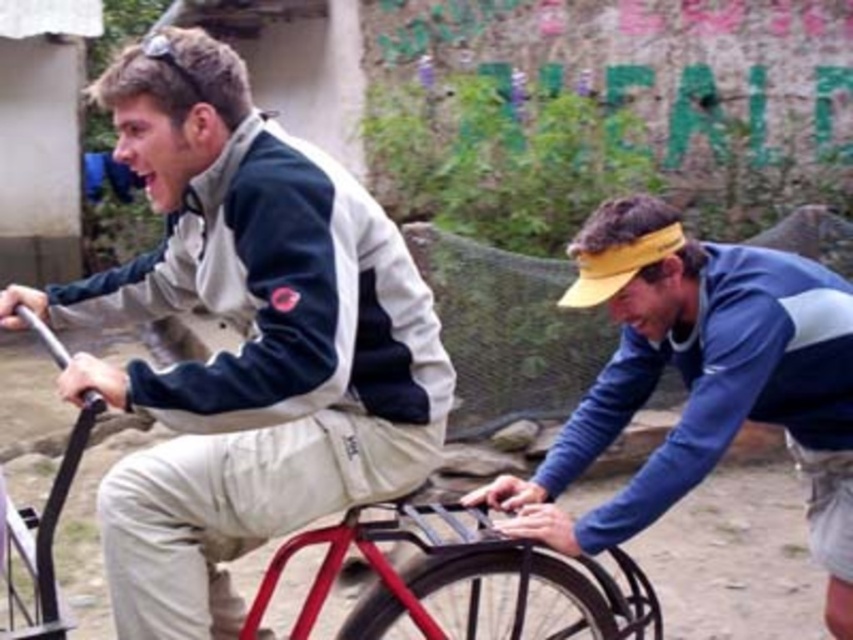
Who is more distant from viewer, (x=740, y=412) or (x=380, y=604)?

The point (x=380, y=604) is more distant.

Is black rubber wheel at lower right positioned at the back of black rubber tire at lower center?

No, black rubber wheel at lower right is in front of black rubber tire at lower center.

Who is more forward, (653, 273) or (387, 620)?

Positioned in front is point (387, 620).

Locate an element on the screen. The image size is (853, 640). black rubber wheel at lower right is located at coordinates (700, 381).

Is black rubber wheel at lower right below metallic red bicycle at center?

No.

Can you confirm if black rubber wheel at lower right is taller than metallic red bicycle at center?

Indeed, black rubber wheel at lower right has a greater height compared to metallic red bicycle at center.

Identify the location of black rubber wheel at lower right. Image resolution: width=853 pixels, height=640 pixels. (700, 381).

Which is in front, point (120, 161) or point (701, 360)?

Point (120, 161) is in front.

Can you confirm if matte white jacket at center is positioned to the left of black rubber wheel at lower right?

Indeed, matte white jacket at center is positioned on the left side of black rubber wheel at lower right.

Which is behind, point (155, 74) or point (813, 298)?

The point (813, 298) is more distant.

In order to click on matte white jacket at center in this screenshot , I will do `click(244, 340)`.